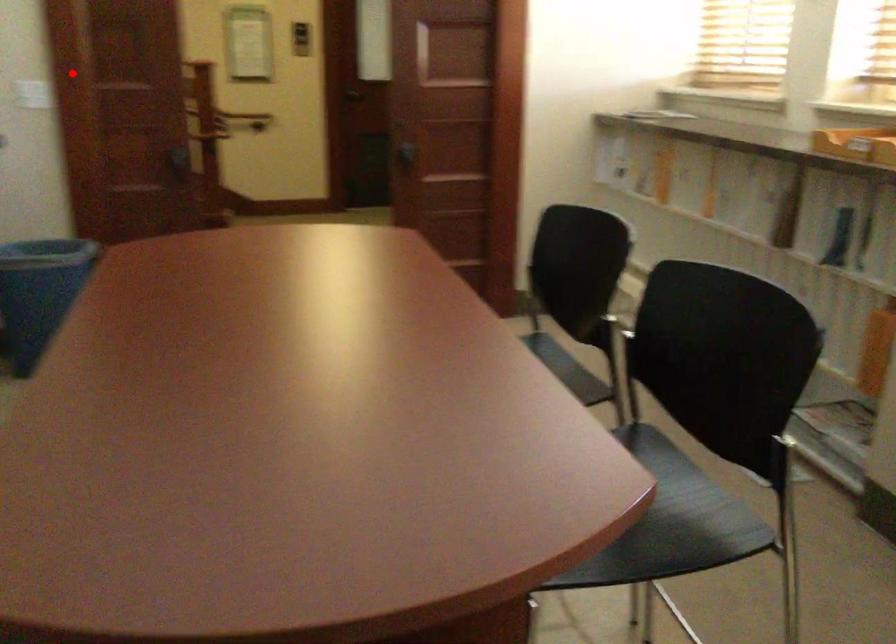
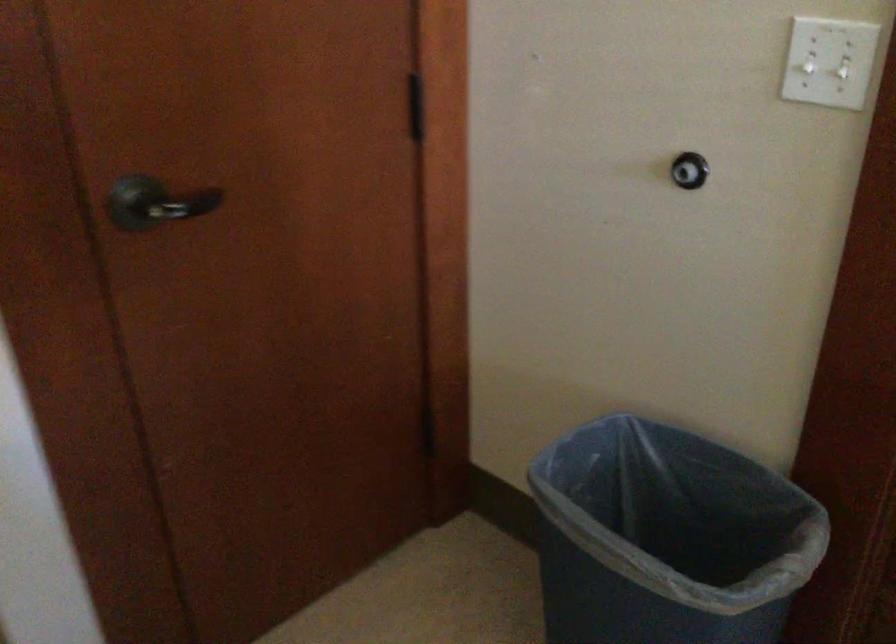
Question: I am providing you with two images of the same scene from different viewpoints. A red point is shown in image1. For the corresponding object point in image2, is it positioned nearer or farther from the camera?

Choices:
 (A) Nearer
 (B) Farther

Answer: (A)